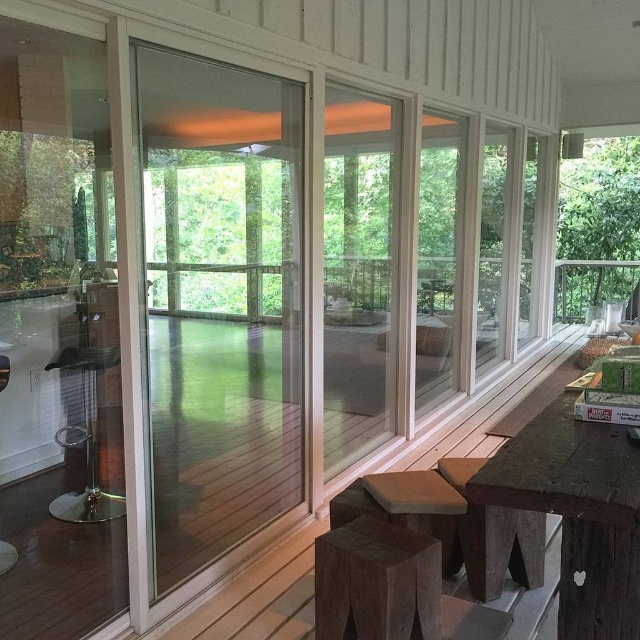
Question: Can you confirm if transparent glass deck at center is positioned to the left of brown wood stool at lower right?

Choices:
 (A) no
 (B) yes

Answer: (A)

Question: Among these points, which one is farthest from the camera?

Choices:
 (A) (145, 257)
 (B) (586, 540)
 (C) (96, 492)

Answer: (C)

Question: Which of the following is the farthest from the observer?

Choices:
 (A) brown wooden table at lower right
 (B) clear glass window at right

Answer: (B)

Question: Which of the following is the farthest from the observer?

Choices:
 (A) brown wooden table at lower right
 (B) dark brown wooden stool at lower center

Answer: (B)

Question: Where is transparent glass screen door at left located in relation to clear glass window at right in the image?

Choices:
 (A) right
 (B) left

Answer: (B)

Question: Is transparent glass screen door at left further to camera compared to black plastic stool at left?

Choices:
 (A) no
 (B) yes

Answer: (A)